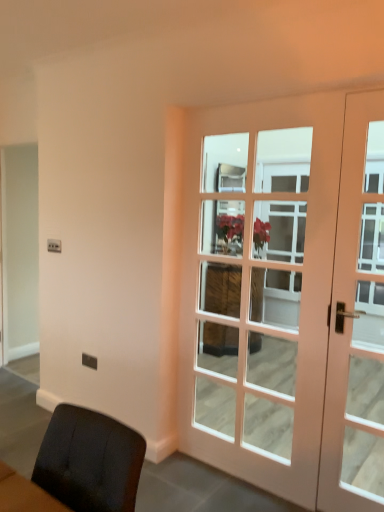
Question: From the image's perspective, is white wood door at right, the first door viewed from the left, positioned above or below matte white door at right, which is the 1th door from right to left?

Choices:
 (A) below
 (B) above

Answer: (B)

Question: From a real-world perspective, is white wood door at right, the first door viewed from the left, above or below matte white door at right, positioned as the second door in left-to-right order?

Choices:
 (A) below
 (B) above

Answer: (B)

Question: Considering their positions, is white wood door at right, the first door viewed from the left, located in front of or behind matte white door at right, positioned as the second door in left-to-right order?

Choices:
 (A) behind
 (B) front

Answer: (B)

Question: Choose the correct answer: Is matte white door at right, positioned as the second door in left-to-right order, inside white wood door at right, the 2th door viewed from the right, or outside it?

Choices:
 (A) outside
 (B) inside

Answer: (B)

Question: Would you say matte white door at right, positioned as the second door in left-to-right order, is to the left or to the right of white wood door at right, the 2th door viewed from the right, in the picture?

Choices:
 (A) left
 (B) right

Answer: (B)

Question: From the image's perspective, relative to white wood door at right, the 2th door viewed from the right, is matte white door at right, which is the 1th door from right to left, above or below?

Choices:
 (A) above
 (B) below

Answer: (B)

Question: In terms of width, does matte white door at right, which is the 1th door from right to left, look wider or thinner when compared to white wood door at right, the 2th door viewed from the right?

Choices:
 (A) thin
 (B) wide

Answer: (A)